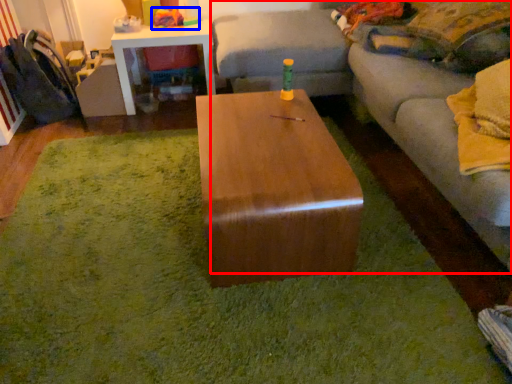
Question: Which of the following is the farthest to the observer, studio couch (highlighted by a red box) or toy (highlighted by a blue box)?

Choices:
 (A) studio couch
 (B) toy

Answer: (B)